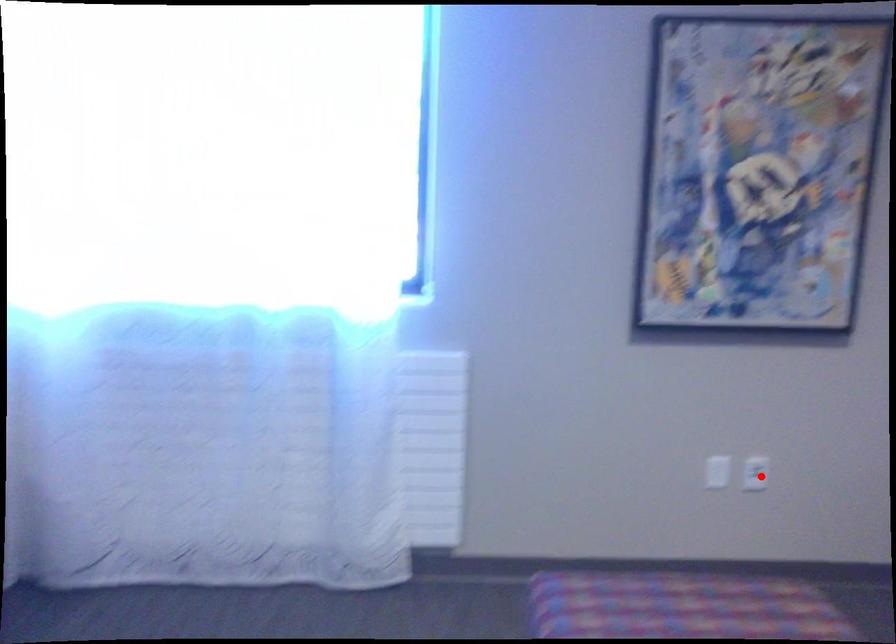
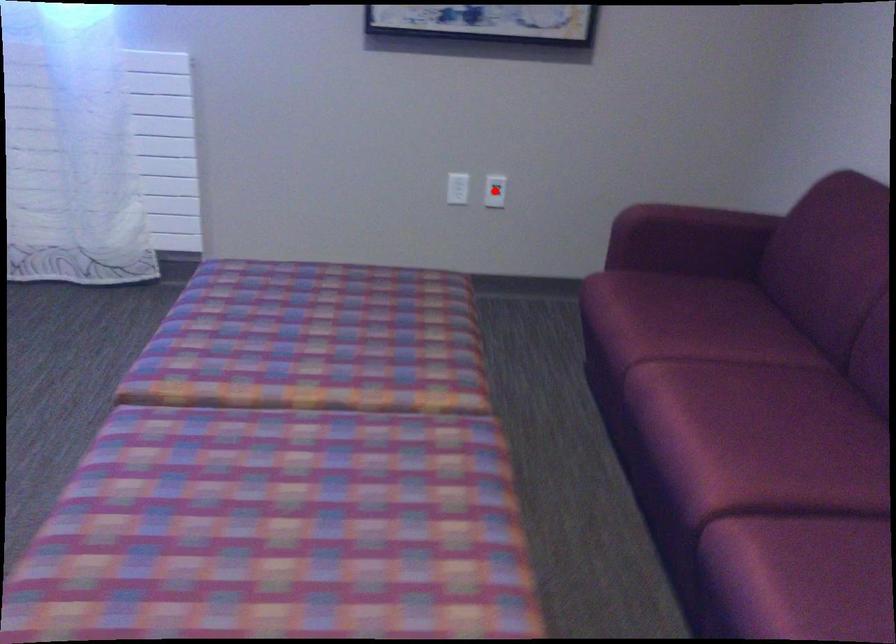
I am providing you with two images of the same scene from different viewpoints. A red point is marked on the first image and another point is marked on the second image. Do the highlighted points in image1 and image2 indicate the same real-world spot?

Yes